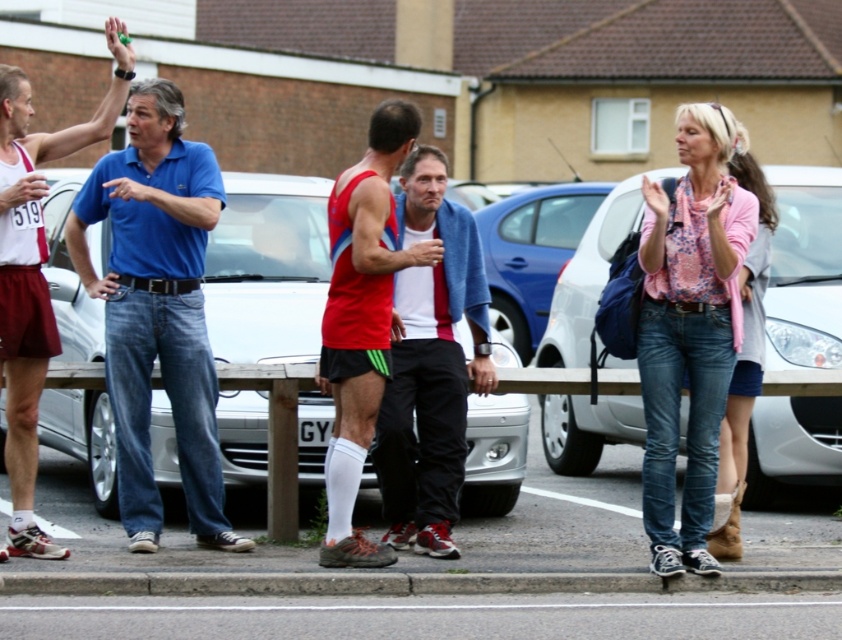
Question: Estimate the real-world distances between objects in this image. Which object is farther from the smooth asphalt road at center?

Choices:
 (A) red fabric tank top at center
 (B) metallic silver car at right
 (C) floral print blouse at center
 (D) silver metallic car at center

Answer: (B)

Question: Does silver metallic car at center appear over matte blue polo shirt at left?

Choices:
 (A) no
 (B) yes

Answer: (B)

Question: Where is metallic silver car at right located in relation to red fabric tank top at center in the image?

Choices:
 (A) left
 (B) right

Answer: (B)

Question: Among these points, which one is farthest from the camera?

Choices:
 (A) (480, 285)
 (B) (40, 214)
 (C) (745, 269)
 (D) (550, 298)

Answer: (D)

Question: Can you confirm if blue metallic car at center is positioned to the right of floral print blouse at center?

Choices:
 (A) yes
 (B) no

Answer: (B)

Question: Which of the following is the closest to the observer?

Choices:
 (A) (408, 148)
 (B) (637, 512)

Answer: (A)